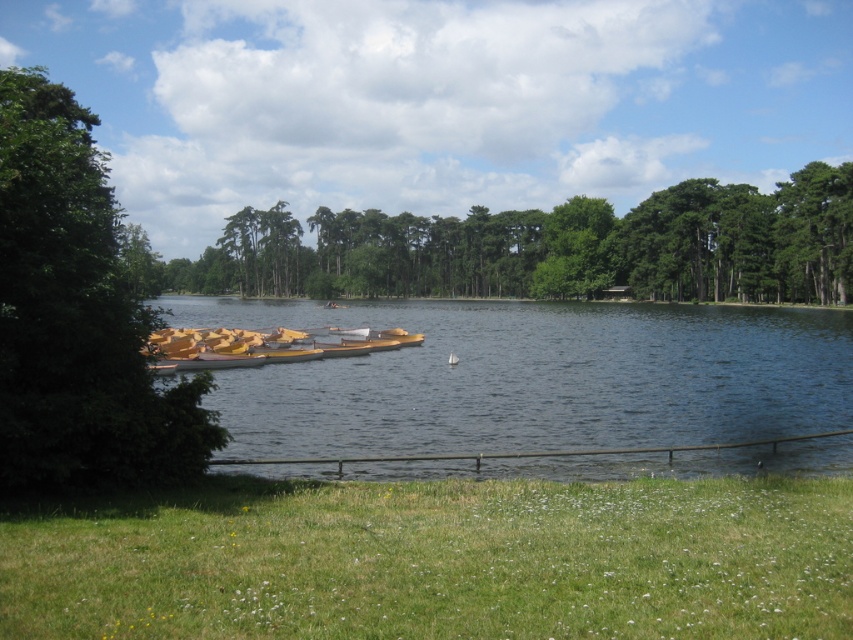
You are standing at the lakeside and looking at two points marked on the image. Which point, point (x=192, y=588) or point (x=767, y=326), is closer to you?

Point (x=192, y=588) is closer to you than point (x=767, y=326).

You are standing at the edge of the lakeside scene. You see the green grass at lower center and the clear blue water at center. Which object is closer to you?

The green grass at lower center is closer to you because it is in front of the clear blue water at center.

You are standing at the lakeside and want to walk from the green grass at lower center to the clear blue water at center. Which direction should you move to reach the water?

You should move to the right because the green grass at lower center is to the left of the clear blue water at center, so moving right will take you towards the water.